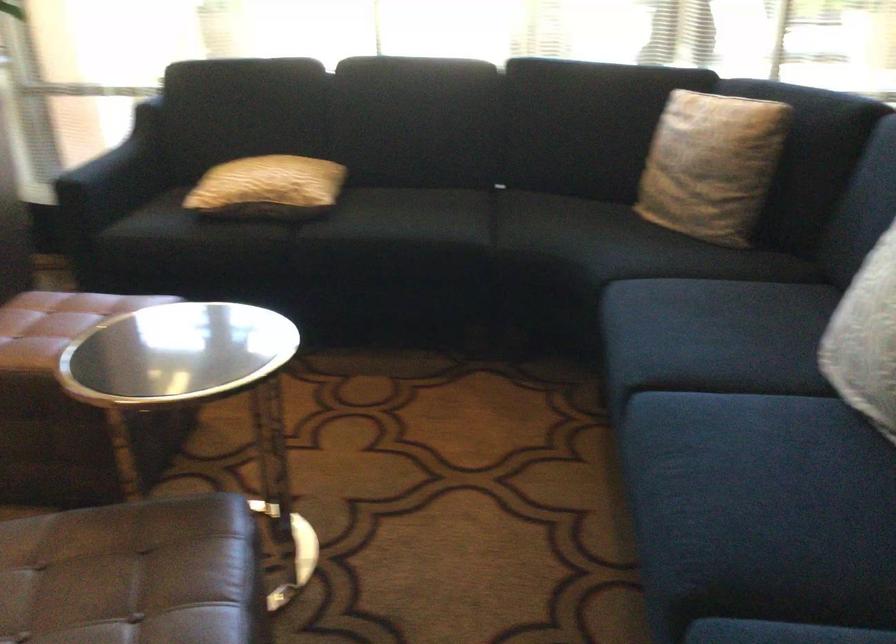
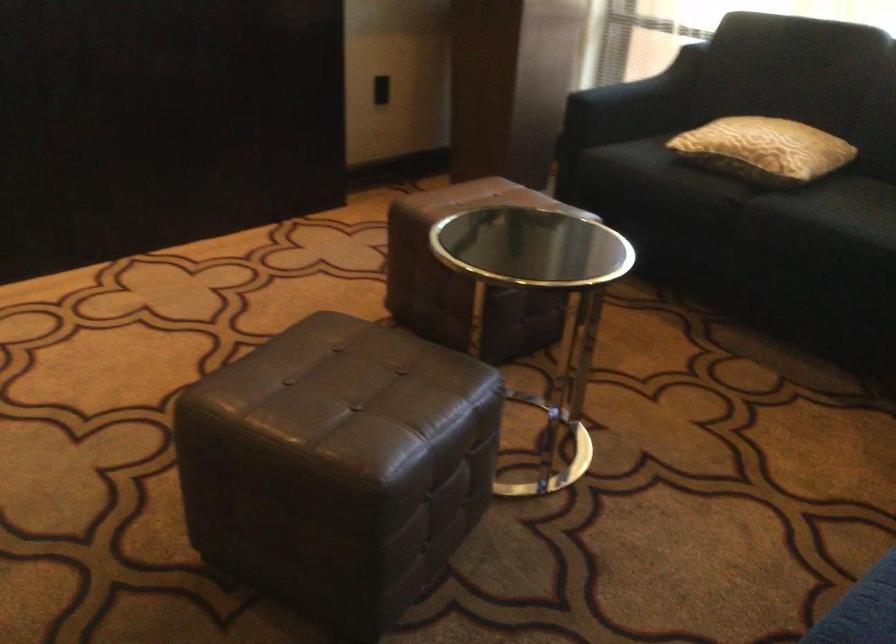
Question: The images are taken continuously from a first-person perspective. In which direction is your viewpoint rotating?

Choices:
 (A) Left
 (B) Right
 (C) Up
 (D) Down

Answer: (A)